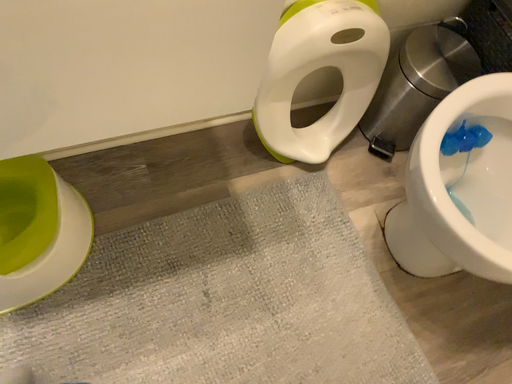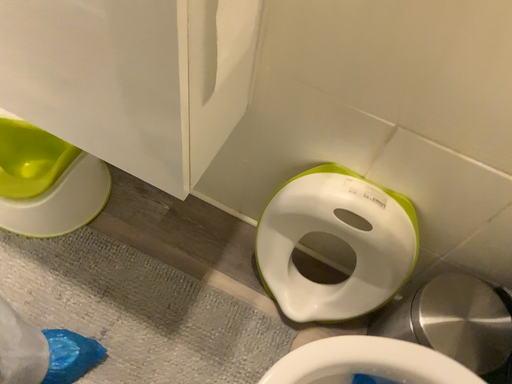
Question: Which way did the camera rotate in the video?

Choices:
 (A) rotated upward
 (B) rotated downward

Answer: (A)